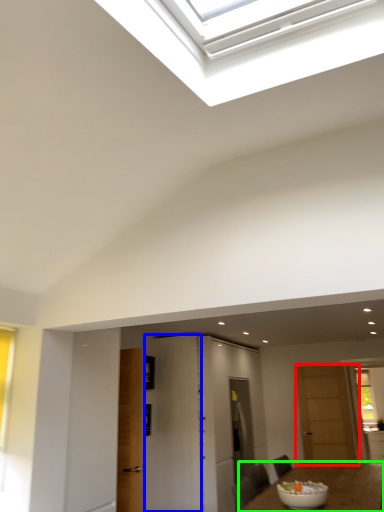
Question: Estimate the real-world distances between objects in this image. Which object is farther from door (highlighted by a red box), door (highlighted by a blue box) or table (highlighted by a green box)?

Choices:
 (A) door
 (B) table

Answer: (A)